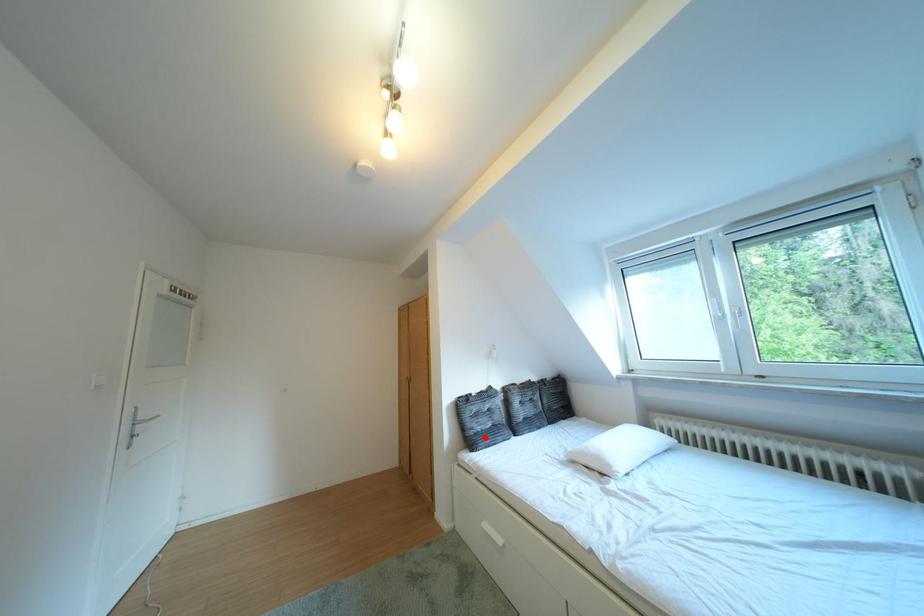
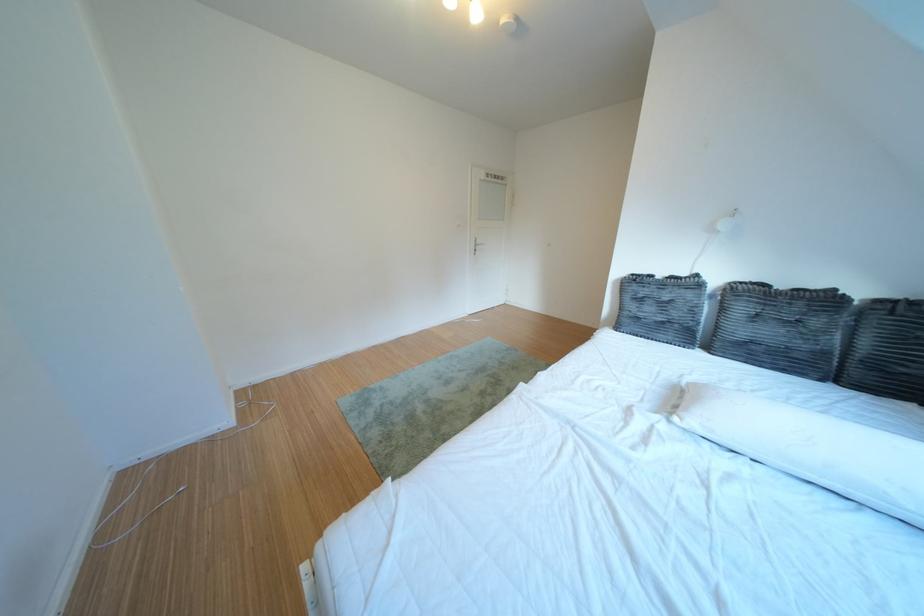
Question: I am providing you with two images of the same scene from different viewpoints. A red point is marked on the first image. At the location where the point appears in image 1, is it still visible in image 2?

Choices:
 (A) Yes
 (B) No

Answer: (A)